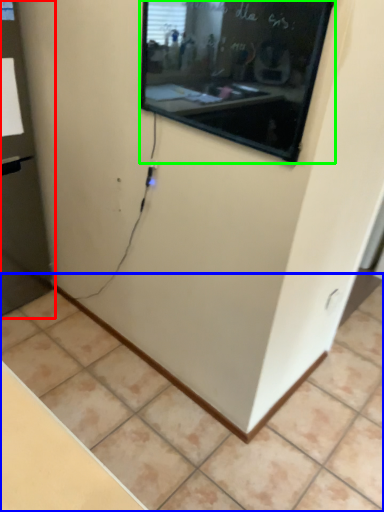
Question: Which is farther away from glass door (highlighted by a red box)? tile (highlighted by a blue box) or projection screen (highlighted by a green box)?

Choices:
 (A) tile
 (B) projection screen

Answer: (B)